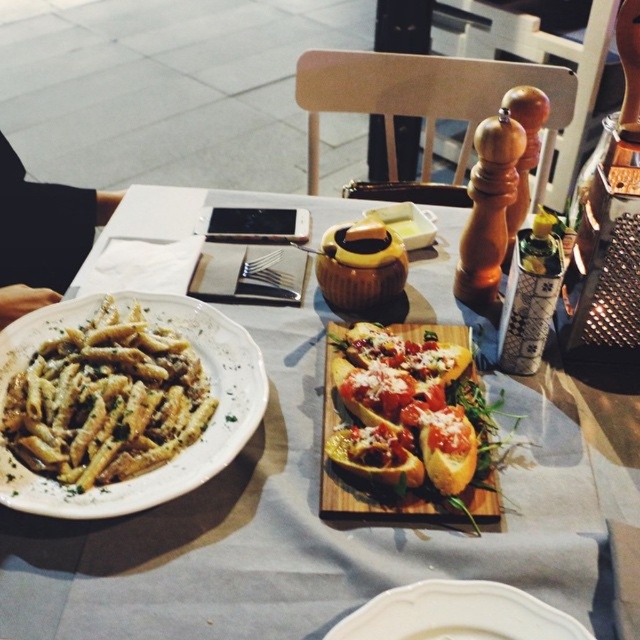
What do you see at coordinates (180, 451) in the screenshot?
I see `white matte plate at left` at bounding box center [180, 451].

Is white matte plate at left to the right of black fabric at upper left from the viewer's perspective?

Yes, white matte plate at left is to the right of black fabric at upper left.

Between point (211, 374) and point (19, 224), which one is positioned in front?

Point (211, 374) is in front.

I want to click on white matte plate at left, so click(x=180, y=451).

Who is higher up, black fabric at upper left or golden brown crusty bread at center?

black fabric at upper left is above.

Can you confirm if black fabric at upper left is positioned above golden brown crusty bread at center?

Yes.

Looking at this image, who is more distant from viewer, [20,170] or [474,516]?

The point [20,170] is more distant.

This screenshot has height=640, width=640. Identify the location of black fabric at upper left. (42, 234).

Is point (12, 150) behind point (365, 608)?

That is True.

Between black fabric at upper left and white ceramic plate at center, which one has more height?

black fabric at upper left is taller.

Find the location of a particular element. The image size is (640, 640). black fabric at upper left is located at coordinates (42, 234).